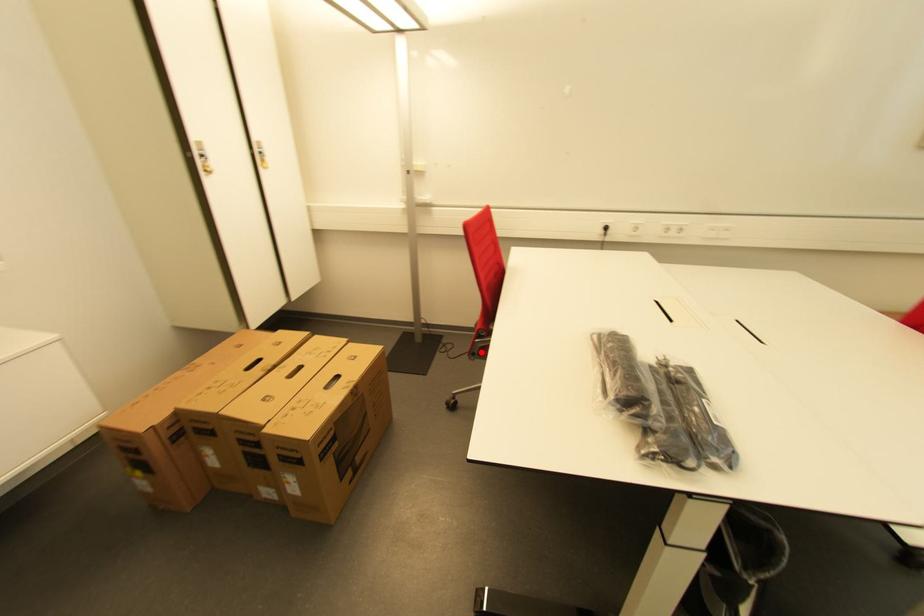
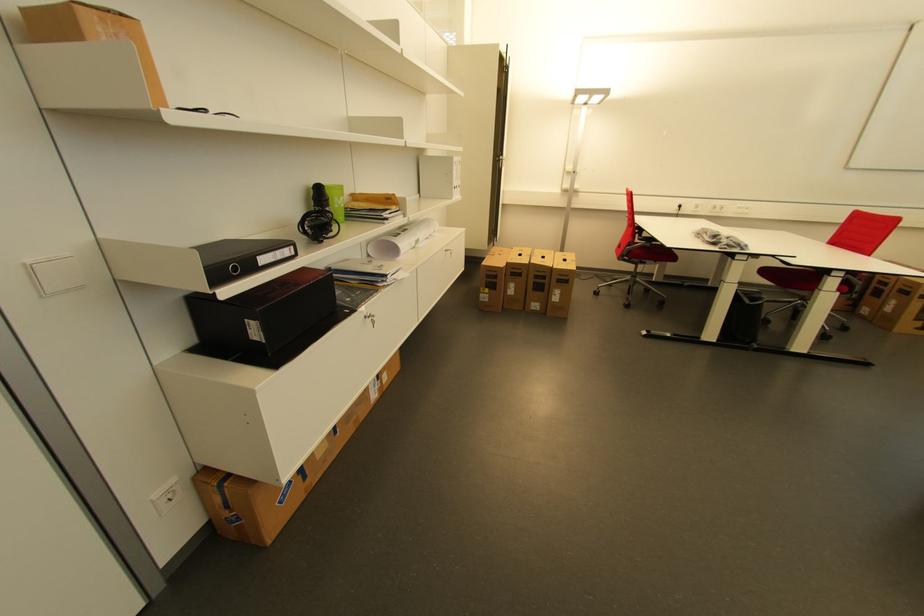
Find the pixel in the second image that matches the highlighted location in the first image.

(629, 254)